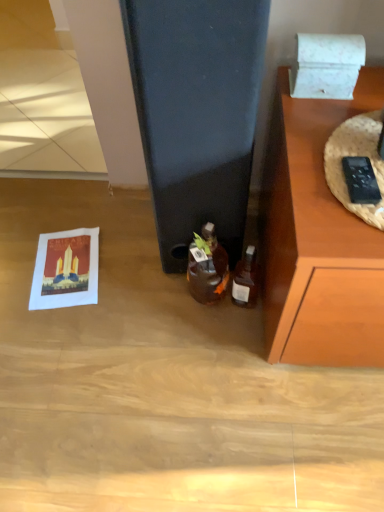
Question: From the image's perspective, is translucent glass bottle at lower right, which ranks as the 1th bottle in right-to-left order, on white marble box at upper right?

Choices:
 (A) yes
 (B) no

Answer: (B)

Question: Is translucent glass bottle at lower right, the 2th bottle when ordered from left to right, thinner than white marble box at upper right?

Choices:
 (A) no
 (B) yes

Answer: (B)

Question: Can you confirm if translucent glass bottle at lower right, the 2th bottle when ordered from left to right, is taller than white marble box at upper right?

Choices:
 (A) no
 (B) yes

Answer: (B)

Question: Is translucent glass bottle at lower right, the 2th bottle when ordered from left to right, facing away from white marble box at upper right?

Choices:
 (A) yes
 (B) no

Answer: (B)

Question: Are translucent glass bottle at lower right, which ranks as the 1th bottle in right-to-left order, and white marble box at upper right located far from each other?

Choices:
 (A) yes
 (B) no

Answer: (B)

Question: From the image's perspective, is matte paper postcard at lower left located above or below translucent glass bottle at lower right, the 2th bottle when ordered from left to right?

Choices:
 (A) below
 (B) above

Answer: (B)

Question: Does point (87, 228) appear closer or farther from the camera than point (244, 285)?

Choices:
 (A) farther
 (B) closer

Answer: (A)

Question: In terms of height, does matte paper postcard at lower left look taller or shorter compared to translucent glass bottle at lower right, which ranks as the 1th bottle in right-to-left order?

Choices:
 (A) short
 (B) tall

Answer: (A)

Question: Is matte paper postcard at lower left to the left or to the right of translucent glass bottle at lower right, which ranks as the 1th bottle in right-to-left order, in the image?

Choices:
 (A) left
 (B) right

Answer: (A)

Question: From the image's perspective, is translucent glass bottle at lower right, which ranks as the 1th bottle in right-to-left order, positioned above or below matte paper postcard at lower left?

Choices:
 (A) above
 (B) below

Answer: (B)

Question: Is translucent glass bottle at lower right, the 2th bottle when ordered from left to right, taller or shorter than matte paper postcard at lower left?

Choices:
 (A) tall
 (B) short

Answer: (A)

Question: Considering the positions of point (233, 271) and point (44, 259), is point (233, 271) closer or farther from the camera than point (44, 259)?

Choices:
 (A) closer
 (B) farther

Answer: (A)

Question: In terms of size, does translucent glass bottle at lower right, the 2th bottle when ordered from left to right, appear bigger or smaller than matte paper postcard at lower left?

Choices:
 (A) big
 (B) small

Answer: (B)

Question: Is matte paper postcard at lower left wider or thinner than white marble box at upper right?

Choices:
 (A) thin
 (B) wide

Answer: (B)

Question: Is matte paper postcard at lower left inside or outside of white marble box at upper right?

Choices:
 (A) inside
 (B) outside

Answer: (B)